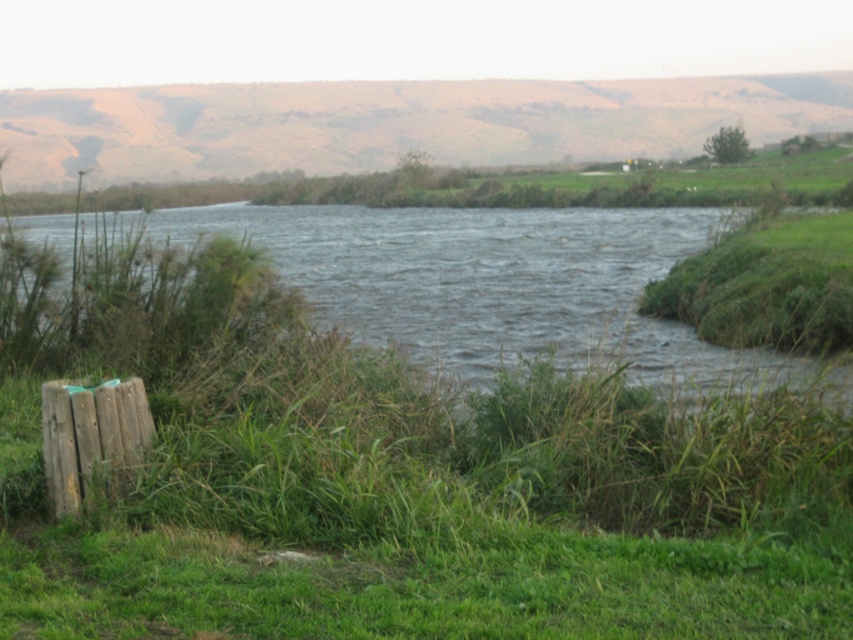
Question: Is dark blue water at center bigger than wooden post at lower left?

Choices:
 (A) yes
 (B) no

Answer: (A)

Question: Does dark blue water at center appear under wooden post at lower left?

Choices:
 (A) yes
 (B) no

Answer: (B)

Question: Can you confirm if dark blue water at center is positioned to the right of wooden post at lower left?

Choices:
 (A) yes
 (B) no

Answer: (B)

Question: Which of the following is the farthest from the observer?

Choices:
 (A) wooden post at lower left
 (B) dark blue water at center

Answer: (B)